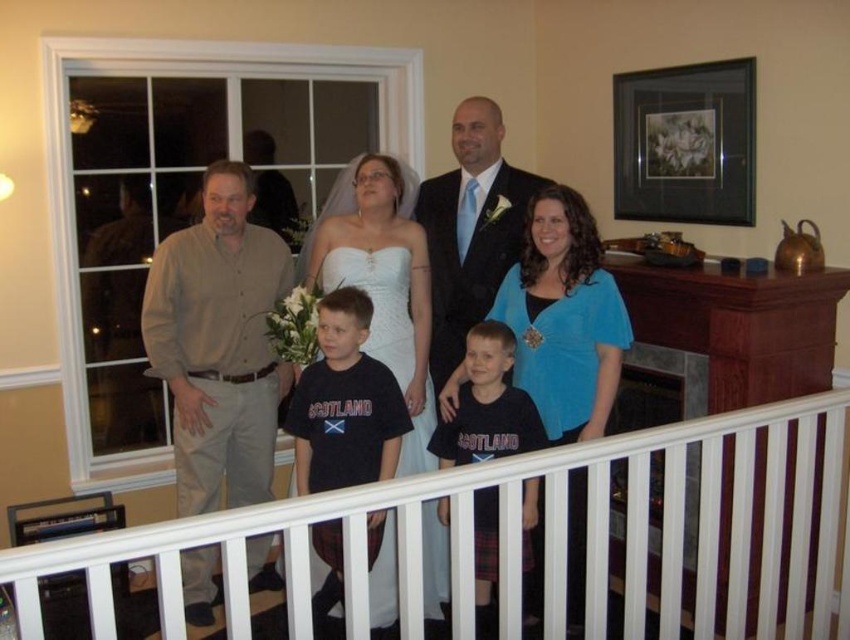
Question: Among these objects, which one is farthest from the camera?

Choices:
 (A) dark blue t-shirt at center
 (B) white wooden rail at center

Answer: (A)

Question: Which point appears closest to the camera in this image?

Choices:
 (A) (473, 394)
 (B) (748, 627)
 (C) (471, 212)
 (D) (540, 404)

Answer: (D)

Question: Does beige cotton shirt at left lie behind shiny black suit at center?

Choices:
 (A) yes
 (B) no

Answer: (B)

Question: Estimate the real-world distances between objects in this image. Which object is farther from the dark blue t-shirt at center?

Choices:
 (A) white satin dress at center
 (B) blue velvet blouse at center
 (C) beige cotton shirt at left

Answer: (B)

Question: Is beige cotton shirt at left to the right of black cotton shirt at center from the viewer's perspective?

Choices:
 (A) no
 (B) yes

Answer: (A)

Question: Is white wooden rail at center thinner than shiny black suit at center?

Choices:
 (A) no
 (B) yes

Answer: (A)